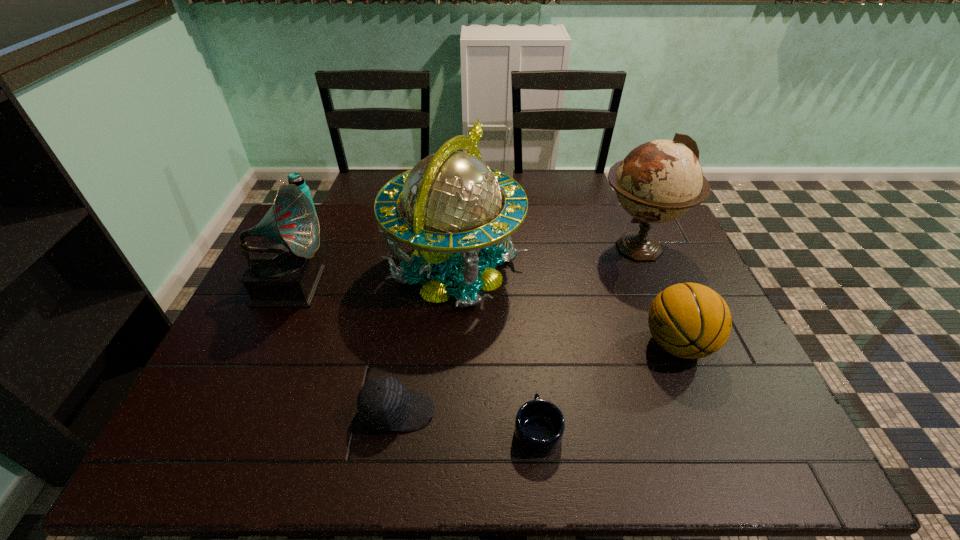
The width and height of the screenshot is (960, 540). I want to click on the left globe, so click(451, 200).

You are a GUI agent. You are given a task and a screenshot of the screen. Output one action in this format:
    pyautogui.click(x=<x>, y=<y>)
    Task: Click on the right globe
    The width and height of the screenshot is (960, 540).
    Given the screenshot: What is the action you would take?
    tap(658, 181)

Where is `record player`? record player is located at coordinates (285, 274).

Identify the location of water bottle. (295, 178).

Identify the location of basketball. The height and width of the screenshot is (540, 960). (689, 320).

Where is `baseball cap`? baseball cap is located at coordinates (383, 403).

Find the location of a particular element. mug is located at coordinates (539, 426).

This screenshot has width=960, height=540. Find the location of `free space located 0.110m on the left of the left globe`. free space located 0.110m on the left of the left globe is located at coordinates (350, 269).

This screenshot has height=540, width=960. What are the coordinates of `free point located on the front of the right globe showing Asia` in the screenshot? It's located at click(x=563, y=247).

Where is `free space located on the front of the right globe showing Asia`? This screenshot has width=960, height=540. free space located on the front of the right globe showing Asia is located at coordinates (577, 247).